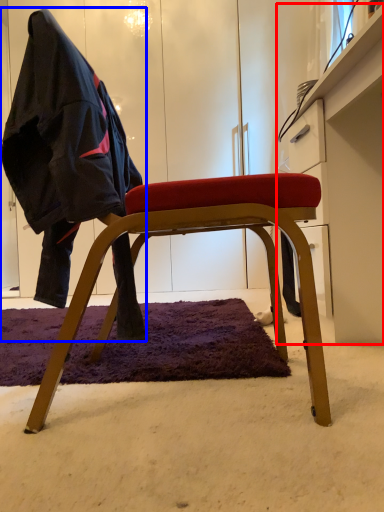
Question: Among these objects, which one is nearest to the camera, dresser (highlighted by a red box) or person (highlighted by a blue box)?

Choices:
 (A) dresser
 (B) person

Answer: (B)